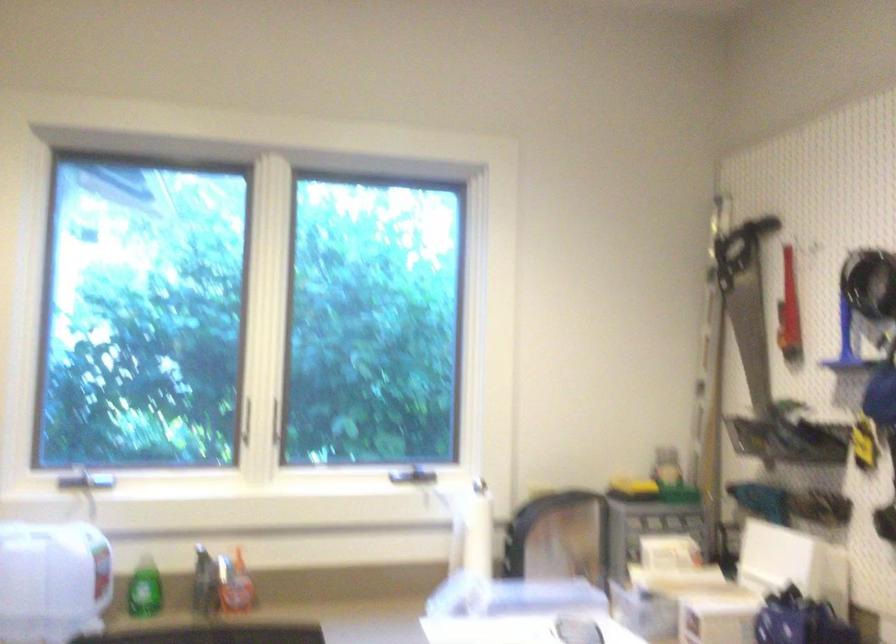
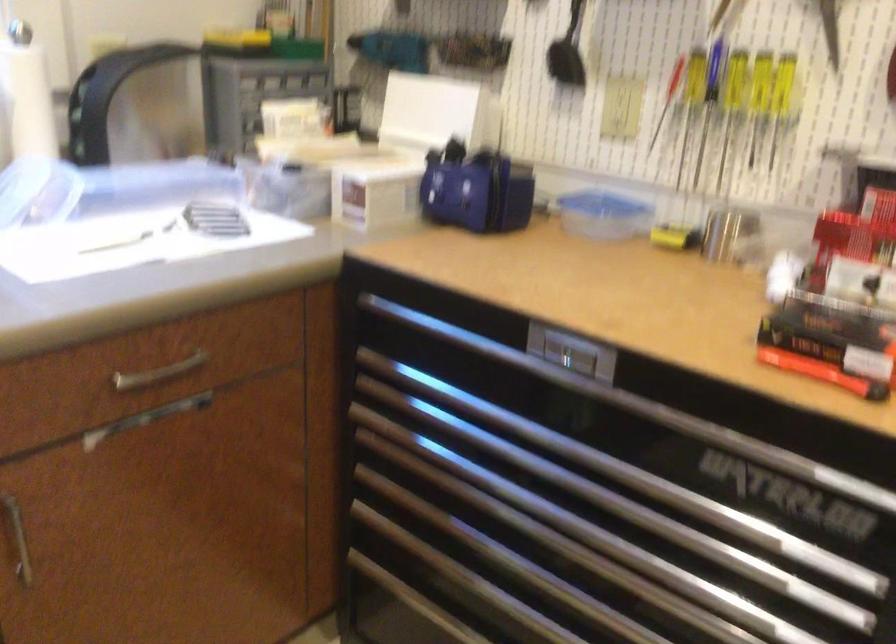
First-person continuous shooting, in which direction is the camera rotating?

The camera rotated toward right-down.